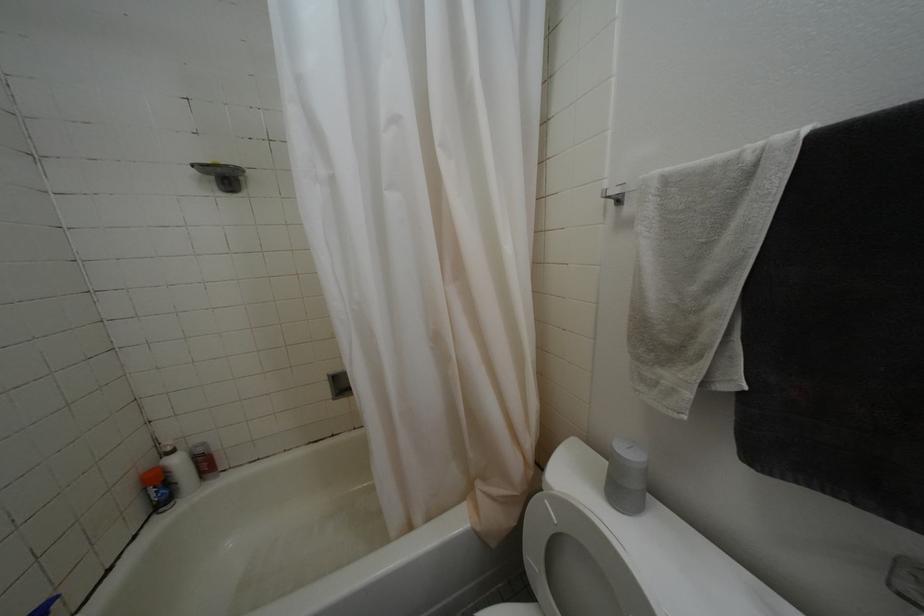
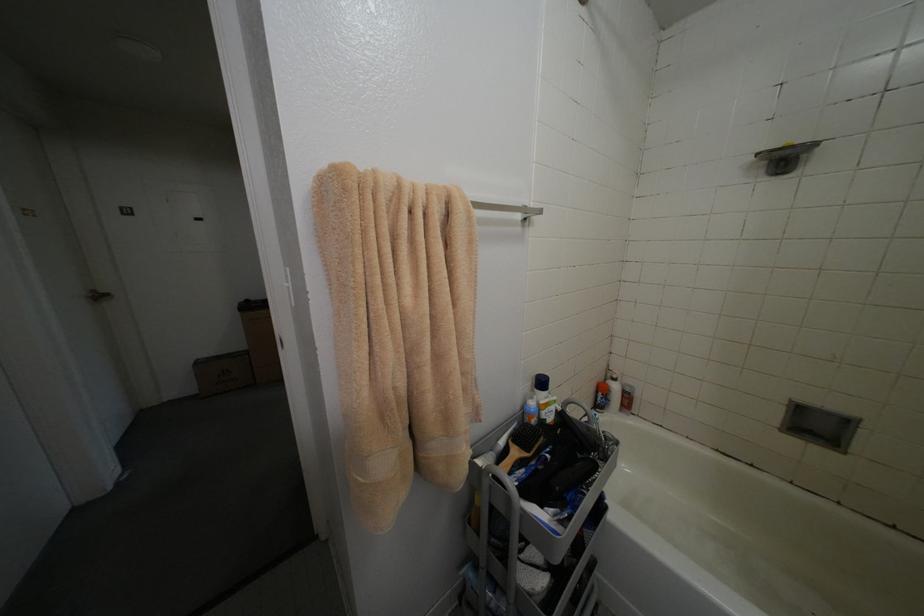
Question: The camera is either moving clockwise (left) or counter-clockwise (right) around the object. The first image is from the beginning of the video and the second image is from the end. Is the camera moving left or right when shooting the video?

Choices:
 (A) Left
 (B) Right

Answer: (B)